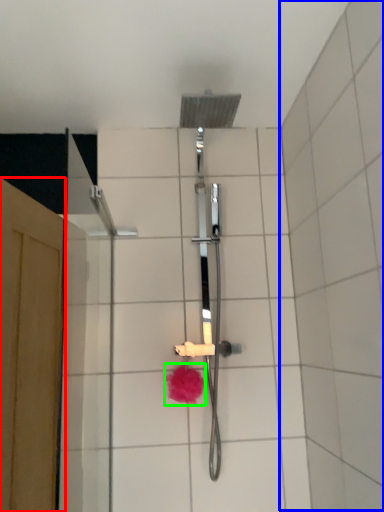
Question: Based on their relative distances, which object is nearer to screen door (highlighted by a red box)? Choose from ceramic tile (highlighted by a blue box) and flower (highlighted by a green box).

Choices:
 (A) ceramic tile
 (B) flower

Answer: (B)